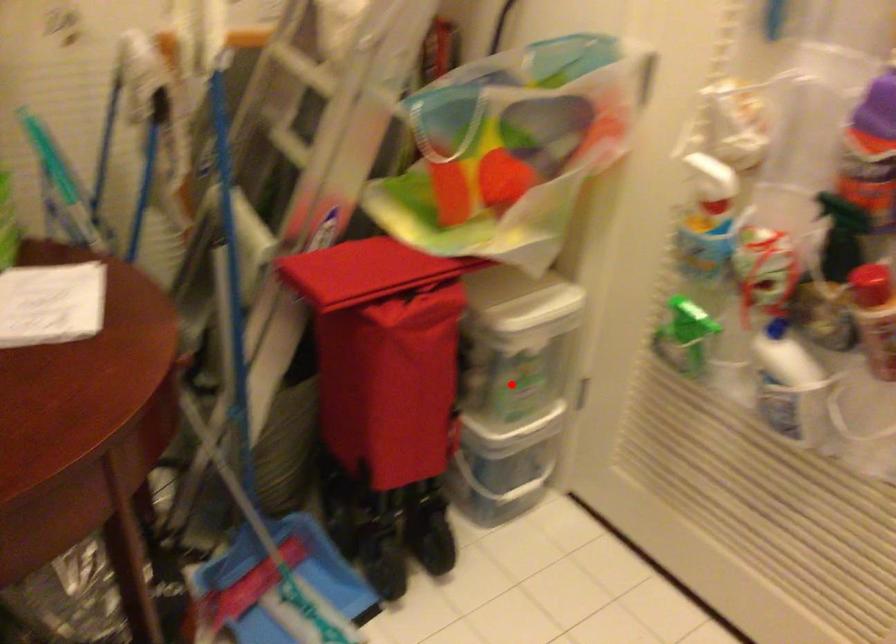
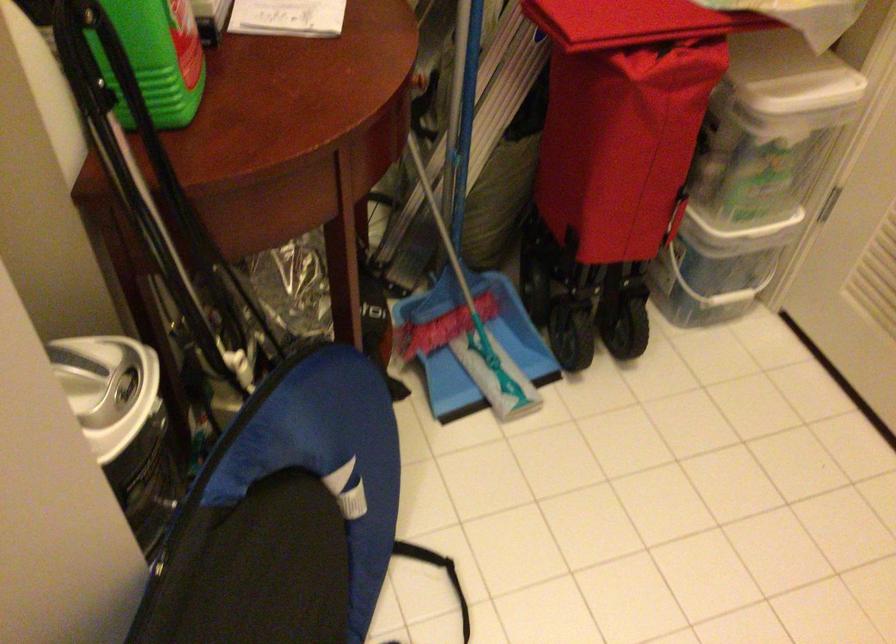
In the second image, find the point that corresponds to the highlighted location in the first image.

(752, 174)